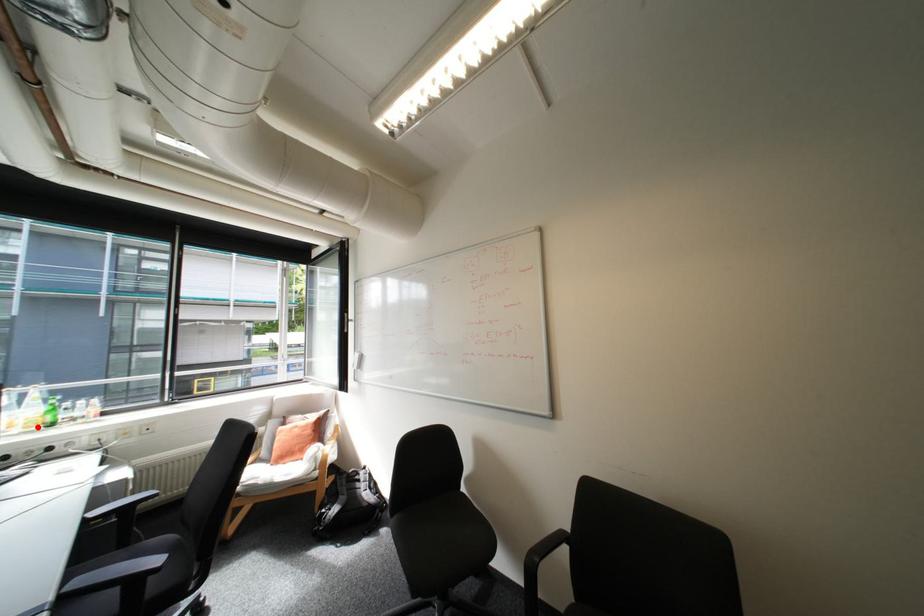
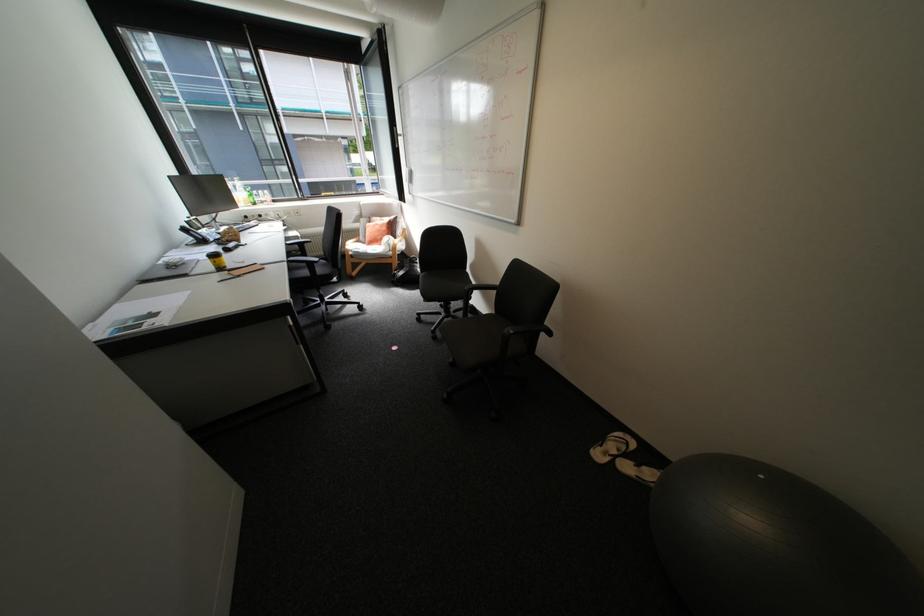
Question: I am providing you with two images of the same scene from different viewpoints. A red point is shown in image1. For the corresponding object point in image2, is it positioned nearer or farther from the camera?

Choices:
 (A) Nearer
 (B) Farther

Answer: (A)